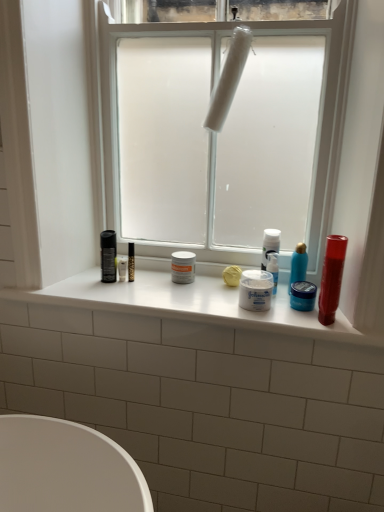
You are a GUI agent. You are given a task and a screenshot of the screen. Output one action in this format:
    pyautogui.click(x=<x>, y=<y>)
    Task: Click on the vacant area located to the right-hand side of white matte jar at center, which appears as the 2th toiletry when viewed from the left
    The width and height of the screenshot is (384, 512).
    Given the screenshot: What is the action you would take?
    pyautogui.click(x=309, y=313)